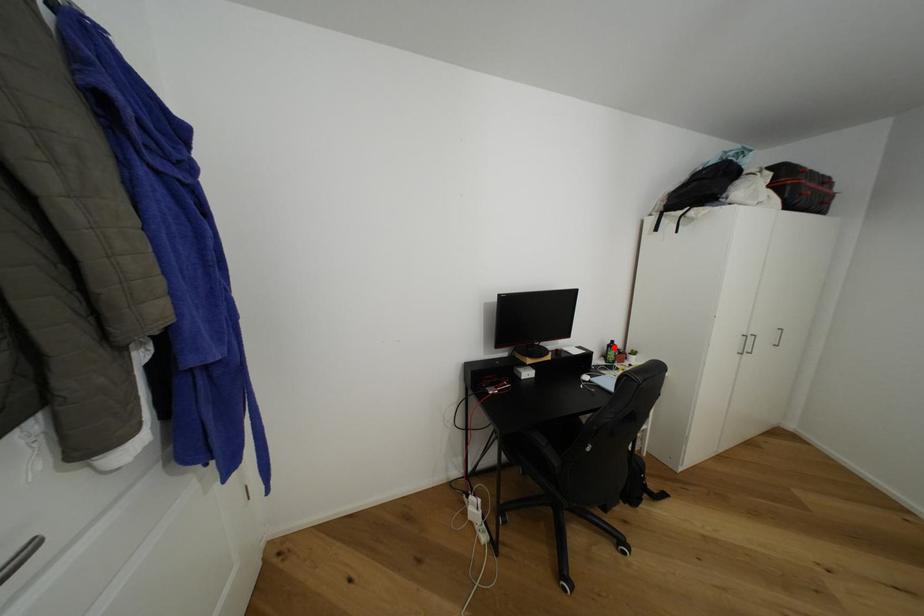
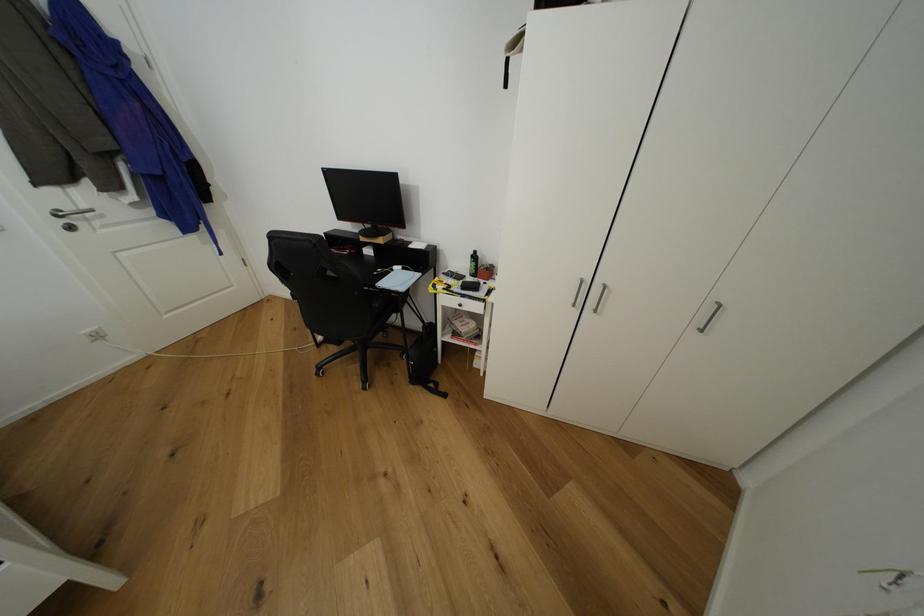
Question: I am providing you with two images of the same scene from different viewpoints. In image1, a red point is highlighted. Considering the same 3D point in image2, which of the following is correct?

Choices:
 (A) It is closer
 (B) It is farther

Answer: (A)